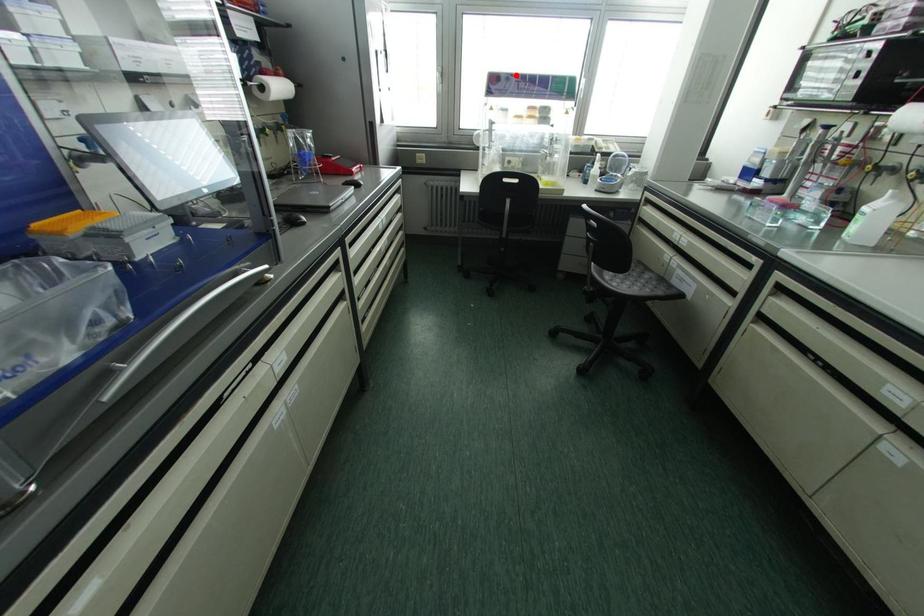
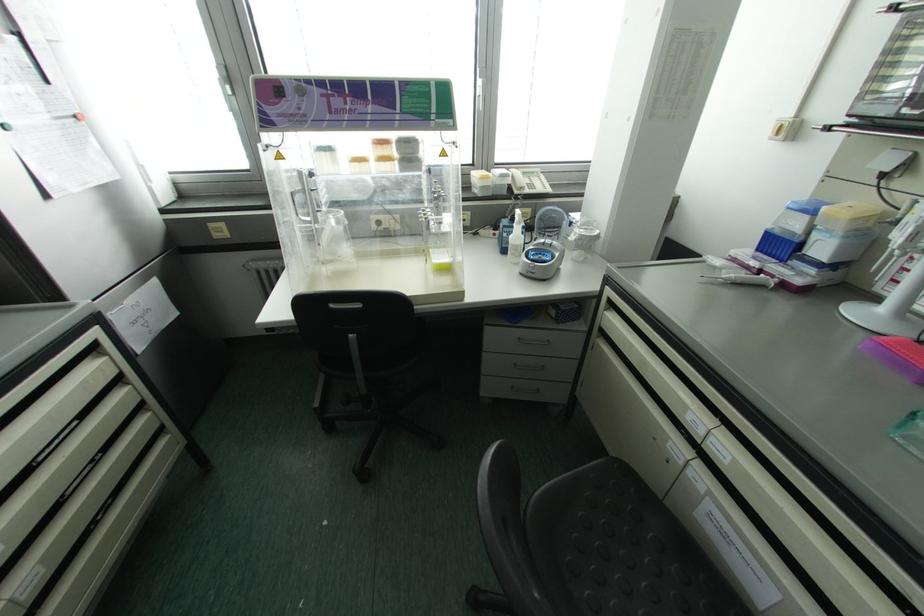
Locate, in the second image, the point that corresponds to the highlighted location in the first image.

(320, 82)